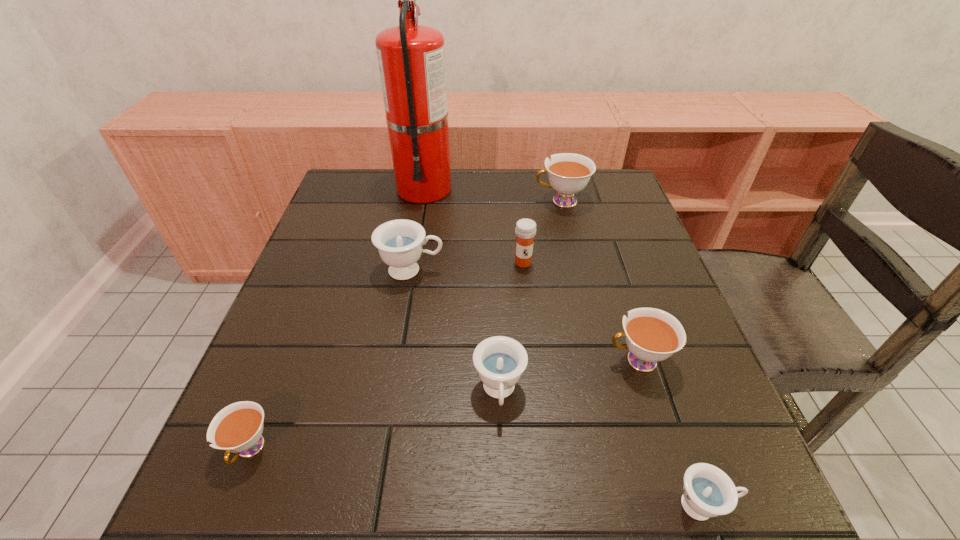
At what (x,y) coordinates should I click in order to perform the action: click on the smallest white teacup. Please return your answer as a coordinate pair (x, y). This screenshot has height=540, width=960. Looking at the image, I should click on (237, 428).

Find the location of a particular element. The width and height of the screenshot is (960, 540). the nearest white teacup is located at coordinates (237, 428).

You are a GUI agent. You are given a task and a screenshot of the screen. Output one action in this format:
    pyautogui.click(x=<x>, y=<y>)
    Task: Click on the smallest blue teacup
    
    Given the screenshot: What is the action you would take?
    pyautogui.click(x=708, y=492)

Image resolution: width=960 pixels, height=540 pixels. Identify the location of the nearest teacup. click(708, 492).

You are a GUI agent. You are given a task and a screenshot of the screen. Output one action in this format:
    pyautogui.click(x=<x>, y=<y>)
    Task: Click on the vacant space located at the nozzle of the fire extinguisher
    
    Given the screenshot: What is the action you would take?
    pyautogui.click(x=418, y=226)

Where is `vacant space located on the side of the farthest teacup with the handle`? Image resolution: width=960 pixels, height=540 pixels. vacant space located on the side of the farthest teacup with the handle is located at coordinates (390, 201).

Identify the location of vacant space situated on the side of the farthest teacup with the handle. The image size is (960, 540). (505, 201).

Find the location of a particular element. This screenshot has width=960, height=540. free spot located on the side of the farthest teacup with the handle is located at coordinates (404, 201).

Image resolution: width=960 pixels, height=540 pixels. I want to click on vacant space situated 0.050m on the label side of the medicine, so click(x=525, y=284).

Locate an element on the screen. The width and height of the screenshot is (960, 540). vacant space positioned on the side of the second farthest teacup with the handle is located at coordinates (540, 270).